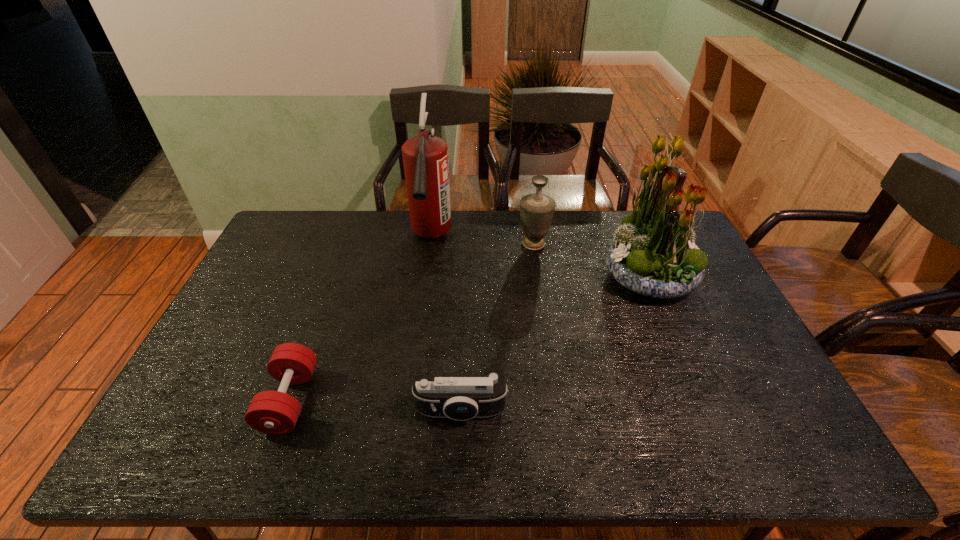
This screenshot has width=960, height=540. I want to click on vacant space situated 0.050m on the front-facing side of the flower arrangement, so click(588, 278).

The height and width of the screenshot is (540, 960). I want to click on free space located on the left of the third shortest object, so click(480, 244).

Locate an element on the screen. free space located on the right of the dumbbell is located at coordinates (393, 400).

The width and height of the screenshot is (960, 540). I want to click on fire extinguisher present at the far edge, so click(425, 158).

Identify the location of flower arrangement at the far edge. (653, 254).

The height and width of the screenshot is (540, 960). What are the coordinates of `urn located in the far edge section of the desktop` in the screenshot? It's located at (536, 210).

Identify the location of camera that is at the near edge. The width and height of the screenshot is (960, 540). (460, 397).

Identify the location of dumbbell that is at the near edge. The height and width of the screenshot is (540, 960). (272, 412).

Identify the location of object that is at the right edge. (653, 254).

Identify the location of object at the far right corner. (653, 254).